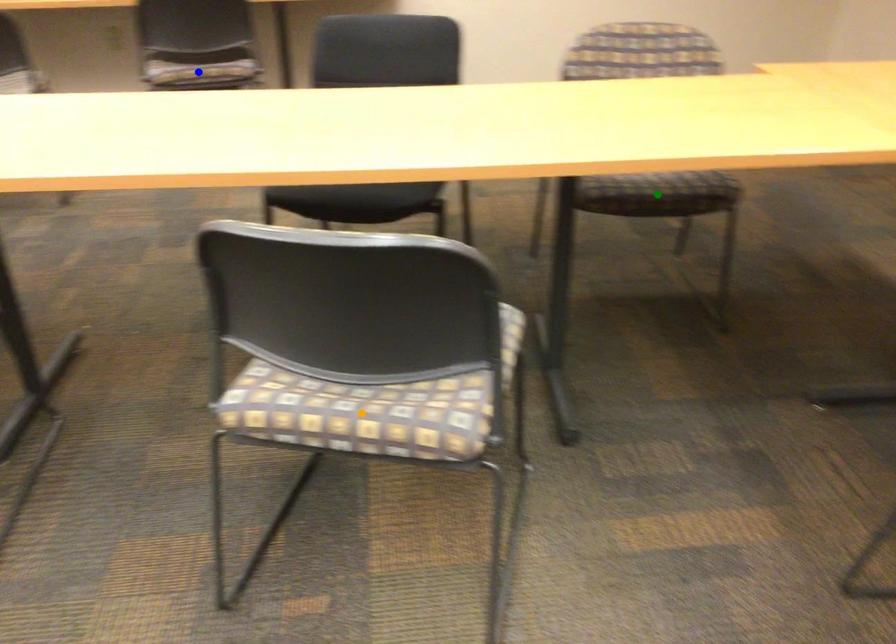
Order these from nearest to farthest:
1. orange point
2. green point
3. blue point

blue point → green point → orange point